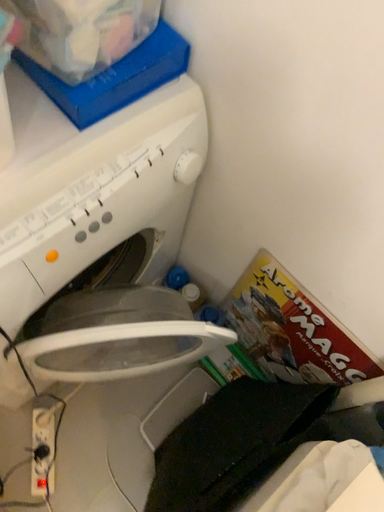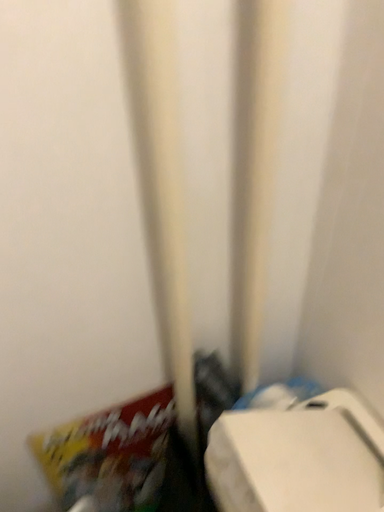
Question: Which way did the camera rotate in the video?

Choices:
 (A) rotated downward
 (B) rotated upward

Answer: (B)